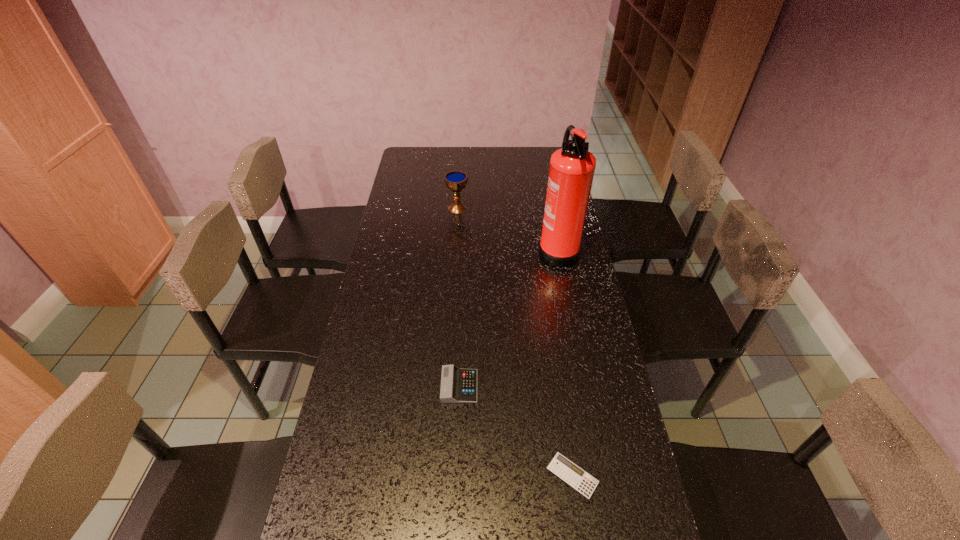
In order to click on the second closest object to the chalice in this screenshot , I will do `click(458, 385)`.

Locate an element on the screen. the third closest object relative to the third nearest object is located at coordinates click(x=561, y=466).

Where is `free location that satisfies the following two spatial constraints: 1. on the front side of the nearest object; 2. on the left side of the farther calculator`? The width and height of the screenshot is (960, 540). free location that satisfies the following two spatial constraints: 1. on the front side of the nearest object; 2. on the left side of the farther calculator is located at coordinates (456, 475).

The width and height of the screenshot is (960, 540). Identify the location of blank area in the image that satisfies the following two spatial constraints: 1. on the front side of the shorter calculator; 2. on the right side of the chalice. (441, 475).

Where is `vacant area that satisfies the following two spatial constraints: 1. at the nozzle of the third nearest object; 2. on the front side of the taller calculator`? This screenshot has width=960, height=540. vacant area that satisfies the following two spatial constraints: 1. at the nozzle of the third nearest object; 2. on the front side of the taller calculator is located at coordinates (584, 386).